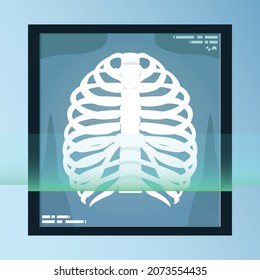
Locate an element on the screen. The width and height of the screenshot is (260, 280). light blue frame is located at coordinates (163, 245).